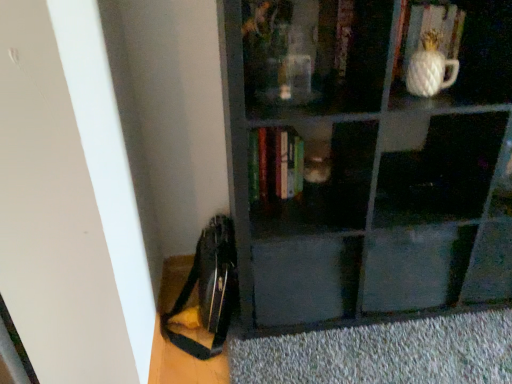
Question: Considering the positions of matte black drawer at center and matte black bookshelf at center in the image, is matte black drawer at center wider or thinner than matte black bookshelf at center?

Choices:
 (A) wide
 (B) thin

Answer: (B)

Question: Choose the correct answer: Is matte black drawer at center inside matte black bookshelf at center or outside it?

Choices:
 (A) outside
 (B) inside

Answer: (B)

Question: Which object is positioned farthest from the white textured vase at upper right?

Choices:
 (A) wooden book at upper center, which is the 2th book from right to left
 (B) gray textured doormat at lower right
 (C) white ceramic pineapple at upper right, marked as the 1th book in a right-to-left arrangement
 (D) hardcover books at center, the 3th book when ordered from right to left
 (E) matte black bookshelf at center

Answer: (B)

Question: Considering the real-world distances, which object is closest to the wooden book at upper center, the second book positioned from the left?

Choices:
 (A) gray textured doormat at lower right
 (B) matte black drawer at center
 (C) matte black bookshelf at center
 (D) white ceramic pineapple at upper right, positioned as the third book in left-to-right order
 (E) white textured vase at upper right

Answer: (E)